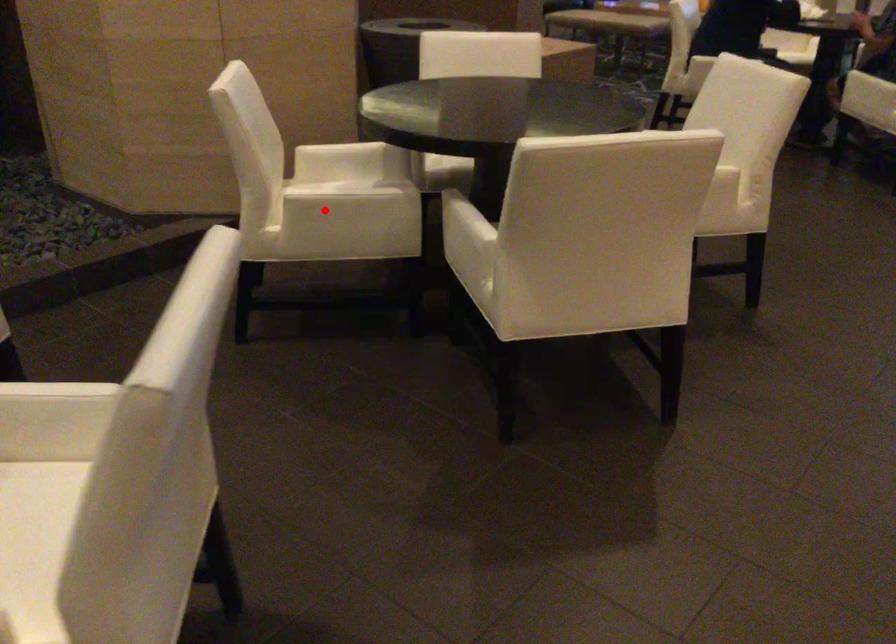
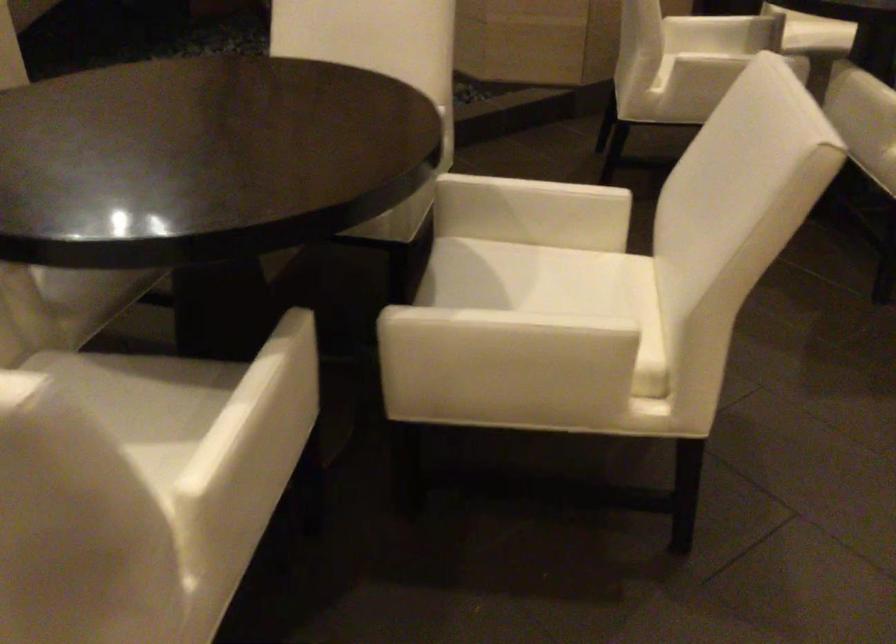
Question: I am providing you with two images of the same scene from different viewpoints. A red point is marked on the first image. At the location where the point appears in image 1, is it still visible in image 2?

Choices:
 (A) Yes
 (B) No

Answer: (A)